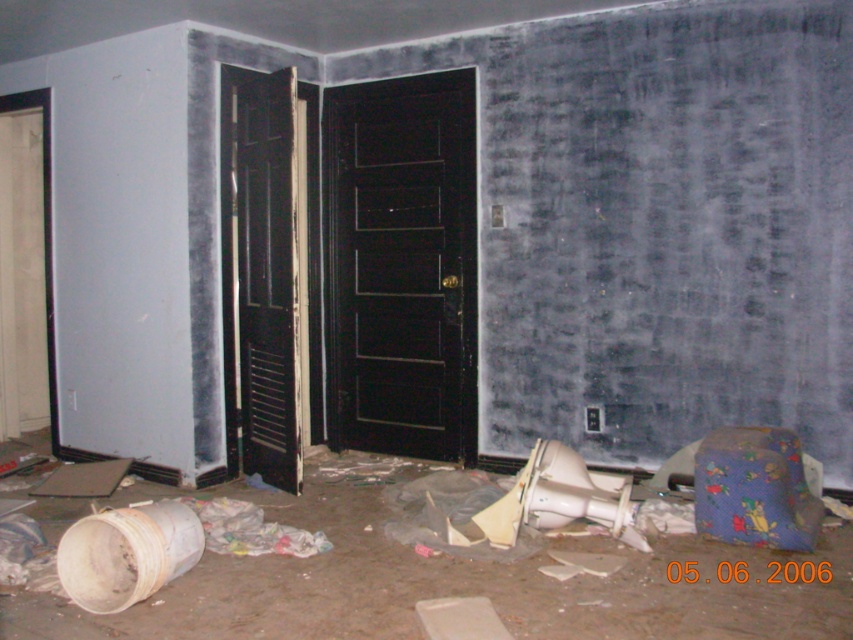
You are a contractor with a 1 meter wide delivery truck. You need to move through the space between the black matte door at center and the black wooden door at center. Can your truck fit through the gap?

The gap between the black matte door at center and the black wooden door at center is 79.82 centimeters. Since the truck is 1 meter wide, it cannot fit through the gap as the gap is narrower than the truck.

You are standing at point (254, 118) and want to reach point (402, 332). Can you walk directly to it without moving around any obstacles?

Point (402, 332) is behind point (254, 118), so you cannot walk directly to it without moving around the obstacle at point (254, 118).

You are a contractor assessing the space. You need to determine which door is more suitable for a new installation. The new door must be large enough to accommodate a standard wheelchair ramp. Which door between the black matte door at center and the black wooden door at center should you choose?

The black matte door at center has a larger size compared to the black wooden door at center, so it is more suitable for accommodating a standard wheelchair ramp.